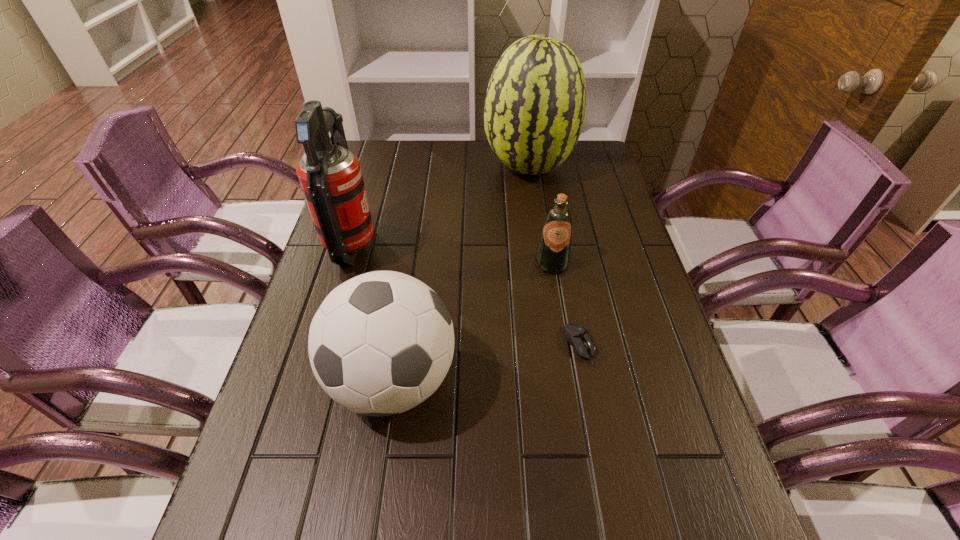
Find the location of `empty space between the farthest object and the fire extinguisher`. empty space between the farthest object and the fire extinguisher is located at coordinates (441, 207).

The height and width of the screenshot is (540, 960). I want to click on free spot between the olive oil and the watermelon, so click(x=540, y=216).

At what (x,y) coordinates should I click in order to perform the action: click on vacant space that's between the shortest object and the second shortest object. Please return your answer as a coordinate pair (x, y). Looking at the image, I should click on (565, 305).

Identify the location of free point between the shortest object and the olive oil. (565, 305).

At what (x,y) coordinates should I click in order to perform the action: click on vacant region between the fourth tallest object and the fire extinguisher. Please return your answer as a coordinate pair (x, y). Image resolution: width=960 pixels, height=540 pixels. Looking at the image, I should click on (452, 254).

The height and width of the screenshot is (540, 960). Find the location of `free space between the fire extinguisher and the second shortest object`. free space between the fire extinguisher and the second shortest object is located at coordinates (452, 254).

The height and width of the screenshot is (540, 960). Identify the location of the fourth closest object to the fire extinguisher. (578, 337).

Locate which object is the closest to the olive oil. Please provide its 2D coordinates. Your answer should be formatted as a tuple, i.e. [(x, y)], where the tuple contains the x and y coordinates of a point satisfying the conditions above.

[(578, 337)]

Identify the location of free spot that satisfies the following two spatial constraints: 1. on the front label side of the fire extinguisher; 2. on the left side of the shortest object. The image size is (960, 540). (323, 345).

At what (x,y) coordinates should I click in order to perform the action: click on vacant space that satisfies the following two spatial constraints: 1. on the front label side of the shortest object; 2. on the left side of the fire extinguisher. Please return your answer as a coordinate pair (x, y). The image size is (960, 540). Looking at the image, I should click on pyautogui.click(x=323, y=345).